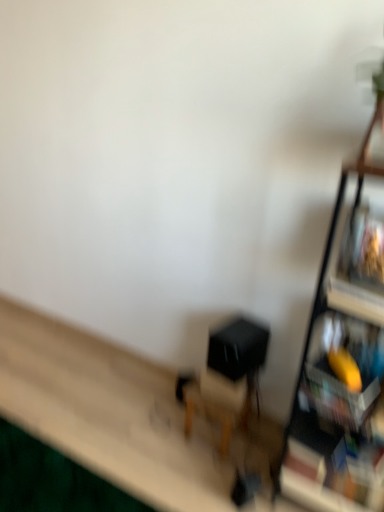
I want to click on matte black swivel chair at center, so click(226, 378).

Describe the element at coordinates (226, 378) in the screenshot. This screenshot has width=384, height=512. I see `matte black swivel chair at center` at that location.

I want to click on wooden shelf at right, so click(344, 353).

What do you see at coordinates (344, 353) in the screenshot? The image size is (384, 512). I see `wooden shelf at right` at bounding box center [344, 353].

Find the location of a particular element. The width and height of the screenshot is (384, 512). matte black swivel chair at center is located at coordinates (226, 378).

In the image, is wooden shelf at right on the left side or the right side of matte black swivel chair at center?

From the image, it's evident that wooden shelf at right is to the right of matte black swivel chair at center.

Which object is further away from the camera taking this photo, wooden shelf at right or matte black swivel chair at center?

matte black swivel chair at center is further from the camera.

Does point (358, 279) come behind point (248, 335)?

No, it is in front of (248, 335).

From the image's perspective, is wooden shelf at right positioned above or below matte black swivel chair at center?

Clearly, from the image's perspective, wooden shelf at right is above matte black swivel chair at center.

From a real-world perspective, is wooden shelf at right physically below matte black swivel chair at center?

No.

Considering the sizes of objects wooden shelf at right and matte black swivel chair at center in the image provided, who is wider, wooden shelf at right or matte black swivel chair at center?

wooden shelf at right is wider.

Considering the sizes of wooden shelf at right and matte black swivel chair at center in the image, is wooden shelf at right taller or shorter than matte black swivel chair at center?

In the image, wooden shelf at right appears to be taller than matte black swivel chair at center.

Considering the relative sizes of wooden shelf at right and matte black swivel chair at center in the image provided, is wooden shelf at right bigger than matte black swivel chair at center?

Yes.

Is wooden shelf at right inside the boundaries of matte black swivel chair at center, or outside?

wooden shelf at right exists outside the volume of matte black swivel chair at center.

Is wooden shelf at right next to matte black swivel chair at center?

wooden shelf at right and matte black swivel chair at center are clearly separated.

Does wooden shelf at right turn towards matte black swivel chair at center?

No.

Locate an element on the screen. shelf lying on the right of matte black swivel chair at center is located at coordinates (344, 353).

Looking at this image, between matte black swivel chair at center and wooden shelf at right, which one appears on the left side from the viewer's perspective?

From the viewer's perspective, matte black swivel chair at center appears more on the left side.

Does matte black swivel chair at center come behind wooden shelf at right?

Yes, matte black swivel chair at center is behind wooden shelf at right.

Does point (232, 394) come in front of point (366, 163)?

No, it is not.

From the image's perspective, is matte black swivel chair at center on wooden shelf at right?

Incorrect, from the image's perspective, matte black swivel chair at center is lower than wooden shelf at right.

From the picture: From a real-world perspective, is matte black swivel chair at center physically located above or below wooden shelf at right?

matte black swivel chair at center is below wooden shelf at right.

Which of these two, matte black swivel chair at center or wooden shelf at right, is wider?

With larger width is wooden shelf at right.

Who is taller, matte black swivel chair at center or wooden shelf at right?

wooden shelf at right is taller.

Considering the relative sizes of matte black swivel chair at center and wooden shelf at right in the image provided, is matte black swivel chair at center bigger than wooden shelf at right?

No.

Is matte black swivel chair at center not inside wooden shelf at right?

Yes, matte black swivel chair at center is outside of wooden shelf at right.

Is matte black swivel chair at center far from wooden shelf at right?

matte black swivel chair at center is near wooden shelf at right, not far away.

Could you tell me if matte black swivel chair at center is turned towards wooden shelf at right?

No, matte black swivel chair at center is not facing towards wooden shelf at right.

Measure the distance from matte black swivel chair at center to wooden shelf at right.

They are 17.47 inches apart.

Find the location of a particular element. swivel chair located below the wooden shelf at right (from the image's perspective) is located at coordinates (226, 378).

Locate an element on the screen. swivel chair below the wooden shelf at right (from the image's perspective) is located at coordinates (226, 378).

Where is `shelf above the matte black swivel chair at center (from the image's perspective)`? shelf above the matte black swivel chair at center (from the image's perspective) is located at coordinates (344, 353).